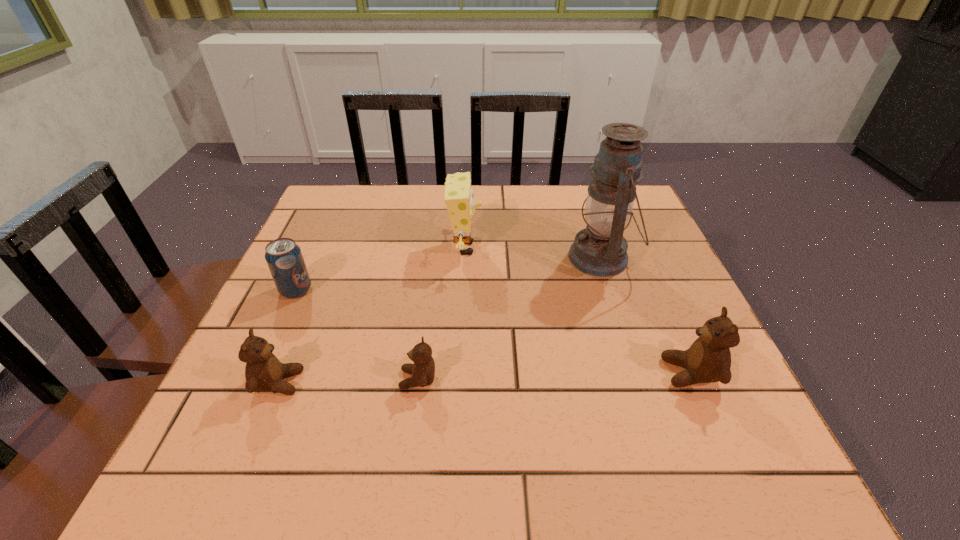
Please determine a free point for an extra teddy_bear to ensure balance. Please provide its 2D coordinates. Your answer should be formatted as a tuple, i.e. [(x, y)], where the tuple contains the x and y coordinates of a point satisfying the conditions above.

[(555, 376)]